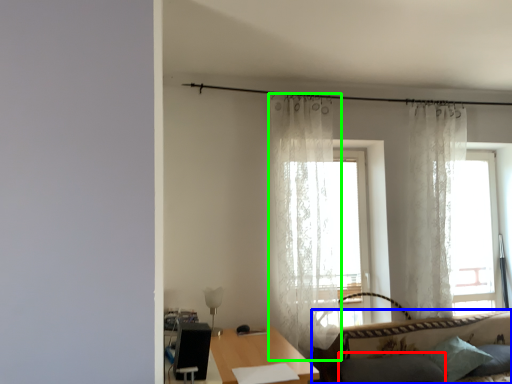
Question: Which object is positioned closest to pillow (highlighted by a red box)? Select from studio couch (highlighted by a blue box) and curtain (highlighted by a green box).

Choices:
 (A) studio couch
 (B) curtain

Answer: (A)